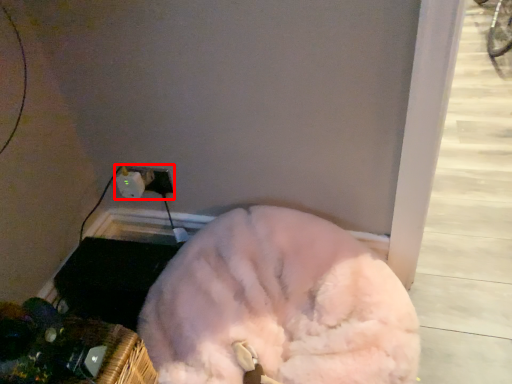
Question: In this image, where is electric outlet (annotated by the red box) located relative to dog?

Choices:
 (A) right
 (B) left

Answer: (B)